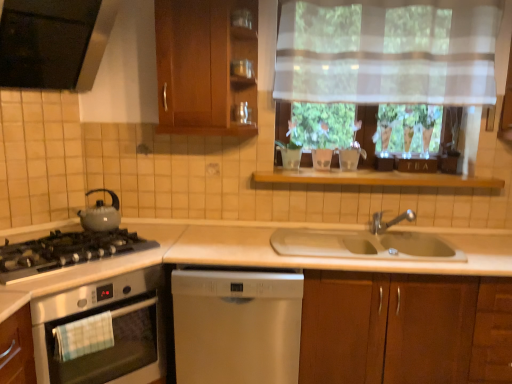
Question: Should I look upward or downward to see wooden shelf at center?

Choices:
 (A) up
 (B) down

Answer: (A)

Question: Does wooden cabinet at lower right, arranged as the 2th cabinetry when viewed from the left, have a larger size compared to matte glass jar at upper center?

Choices:
 (A) no
 (B) yes

Answer: (B)

Question: From a real-world perspective, is wooden cabinet at lower right, which is counted as the 1th cabinetry, starting from the right, positioned under matte glass jar at upper center based on gravity?

Choices:
 (A) yes
 (B) no

Answer: (A)

Question: From a real-world perspective, is wooden cabinet at lower right, the first cabinetry when ordered from bottom to top, on top of matte glass jar at upper center?

Choices:
 (A) no
 (B) yes

Answer: (A)

Question: From the image's perspective, is wooden cabinet at lower right, the first cabinetry when ordered from bottom to top, located above matte glass jar at upper center?

Choices:
 (A) yes
 (B) no

Answer: (B)

Question: From the image's perspective, would you say wooden cabinet at lower right, the first cabinetry when ordered from bottom to top, is shown under matte glass jar at upper center?

Choices:
 (A) yes
 (B) no

Answer: (A)

Question: Is wooden cabinet at lower right, which is counted as the 1th cabinetry, starting from the right, at the right side of matte glass jar at upper center?

Choices:
 (A) yes
 (B) no

Answer: (A)

Question: From the image's perspective, does stainless steel oven at left, the first kitchen appliance in the bottom-to-top sequence, appear higher than translucent fabric at upper center?

Choices:
 (A) yes
 (B) no

Answer: (B)

Question: Is stainless steel oven at left, which is counted as the second kitchen appliance, starting from the top, to the right of translucent fabric at upper center from the viewer's perspective?

Choices:
 (A) yes
 (B) no

Answer: (B)

Question: Considering the relative sizes of stainless steel oven at left, which is counted as the second kitchen appliance, starting from the top, and translucent fabric at upper center in the image provided, is stainless steel oven at left, which is counted as the second kitchen appliance, starting from the top, thinner than translucent fabric at upper center?

Choices:
 (A) no
 (B) yes

Answer: (A)

Question: Considering the relative sizes of stainless steel oven at left, which is counted as the second kitchen appliance, starting from the top, and translucent fabric at upper center in the image provided, is stainless steel oven at left, which is counted as the second kitchen appliance, starting from the top, smaller than translucent fabric at upper center?

Choices:
 (A) no
 (B) yes

Answer: (A)

Question: Can you confirm if stainless steel oven at left, which is counted as the second kitchen appliance, starting from the top, is bigger than translucent fabric at upper center?

Choices:
 (A) no
 (B) yes

Answer: (B)

Question: From a real-world perspective, does stainless steel oven at left, which is counted as the second kitchen appliance, starting from the top, sit lower than translucent fabric at upper center?

Choices:
 (A) no
 (B) yes

Answer: (B)

Question: Is matte gray gas stove at left completely or partially inside wooden cabinet at upper center, placed as the 1th cabinetry when sorted from top to bottom?

Choices:
 (A) yes
 (B) no

Answer: (B)